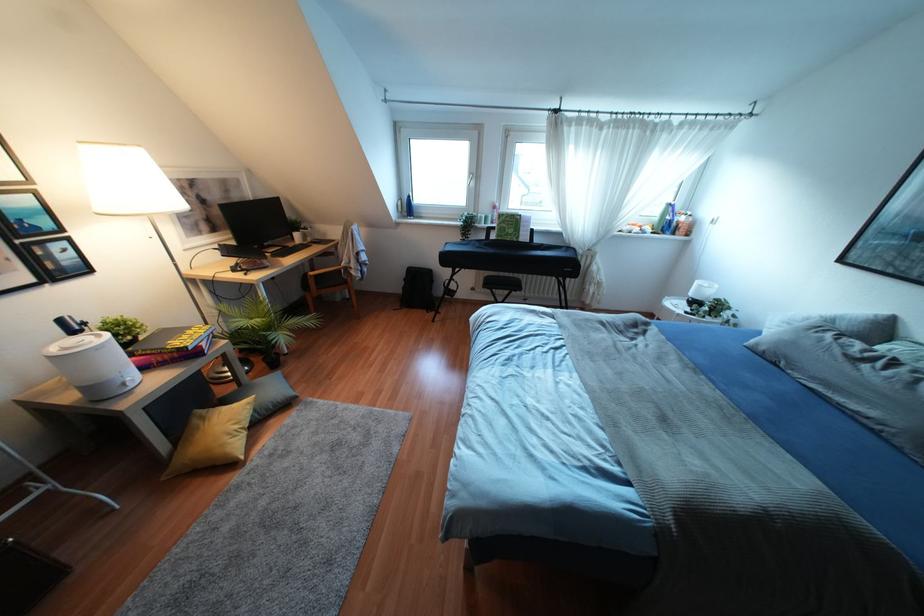
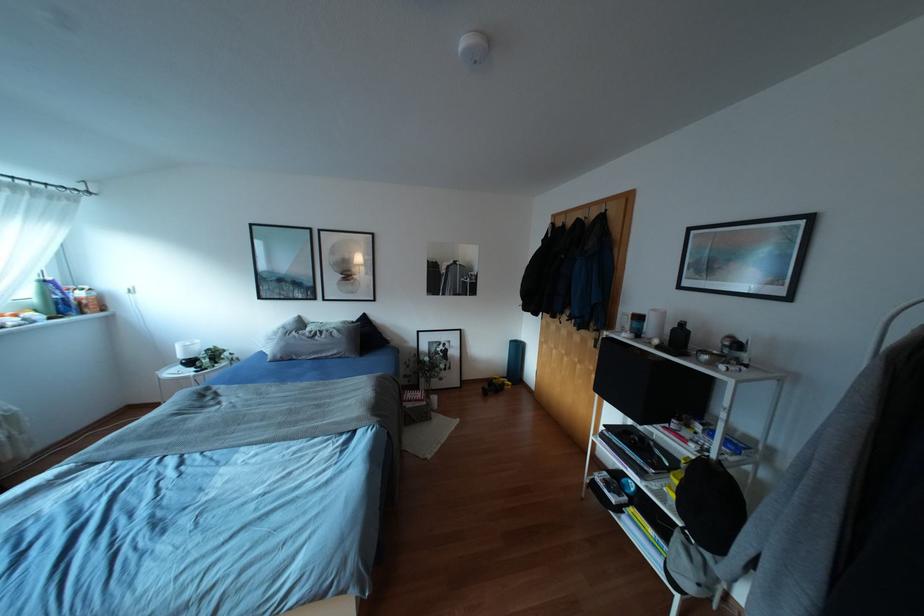
How did the camera likely rotate?

The rotation direction of the camera is right-down.